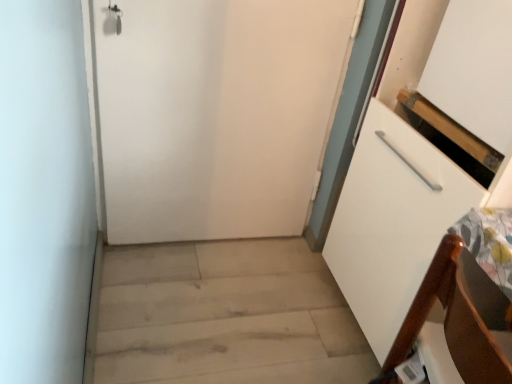
Question: Is brown wood chair at lower right thinner than white matte door at center?

Choices:
 (A) no
 (B) yes

Answer: (A)

Question: Is brown wood chair at lower right to the right of white matte door at center from the viewer's perspective?

Choices:
 (A) yes
 (B) no

Answer: (A)

Question: Are brown wood chair at lower right and white matte door at center far apart?

Choices:
 (A) no
 (B) yes

Answer: (B)

Question: Is brown wood chair at lower right closer to the viewer compared to white matte door at center?

Choices:
 (A) no
 (B) yes

Answer: (B)

Question: Is brown wood chair at lower right looking in the opposite direction of white matte door at center?

Choices:
 (A) yes
 (B) no

Answer: (B)

Question: Is brown wood chair at lower right to the left of white matte door at center from the viewer's perspective?

Choices:
 (A) yes
 (B) no

Answer: (B)

Question: Could you tell me if brown wood chair at lower right is facing light wood floor at lower left?

Choices:
 (A) no
 (B) yes

Answer: (A)

Question: Would you say light wood floor at lower left is part of brown wood chair at lower right's contents?

Choices:
 (A) no
 (B) yes

Answer: (A)

Question: Is the surface of brown wood chair at lower right in direct contact with light wood floor at lower left?

Choices:
 (A) yes
 (B) no

Answer: (B)

Question: Considering the relative sizes of brown wood chair at lower right and light wood floor at lower left in the image provided, is brown wood chair at lower right thinner than light wood floor at lower left?

Choices:
 (A) no
 (B) yes

Answer: (B)

Question: Can you confirm if brown wood chair at lower right is wider than light wood floor at lower left?

Choices:
 (A) no
 (B) yes

Answer: (A)

Question: Is brown wood chair at lower right positioned behind light wood floor at lower left?

Choices:
 (A) yes
 (B) no

Answer: (B)

Question: Can you confirm if light wood floor at lower left is positioned to the left of white matte door at center?

Choices:
 (A) no
 (B) yes

Answer: (A)